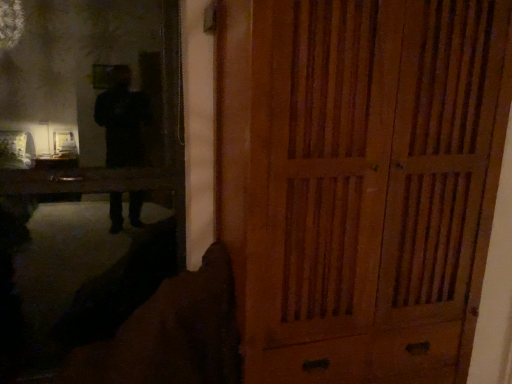
Question: In terms of height, does wooden cabinet at right look taller or shorter compared to matte black mirror at upper left?

Choices:
 (A) short
 (B) tall

Answer: (B)

Question: Is wooden cabinet at right spatially inside matte black mirror at upper left, or outside of it?

Choices:
 (A) inside
 (B) outside

Answer: (B)

Question: Visually, is wooden cabinet at right positioned to the left or to the right of matte black mirror at upper left?

Choices:
 (A) right
 (B) left

Answer: (A)

Question: Considering the positions of matte black mirror at upper left and wooden cabinet at right in the image, is matte black mirror at upper left bigger or smaller than wooden cabinet at right?

Choices:
 (A) big
 (B) small

Answer: (B)

Question: Looking at their shapes, would you say matte black mirror at upper left is wider or thinner than wooden cabinet at right?

Choices:
 (A) thin
 (B) wide

Answer: (A)

Question: From a real-world perspective, is matte black mirror at upper left above or below wooden cabinet at right?

Choices:
 (A) below
 (B) above

Answer: (A)

Question: From the image's perspective, is matte black mirror at upper left positioned above or below wooden cabinet at right?

Choices:
 (A) below
 (B) above

Answer: (B)